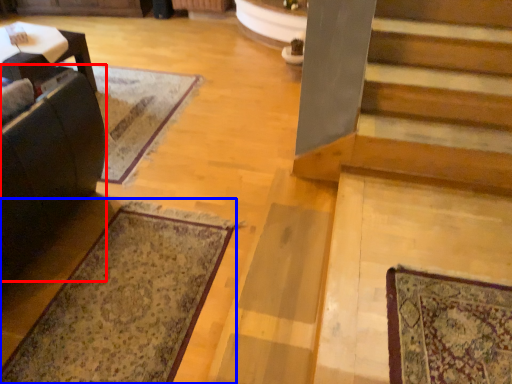
Question: Which point is further to the camera, rocking chair (highlighted by a red box) or mat (highlighted by a blue box)?

Choices:
 (A) rocking chair
 (B) mat

Answer: (B)